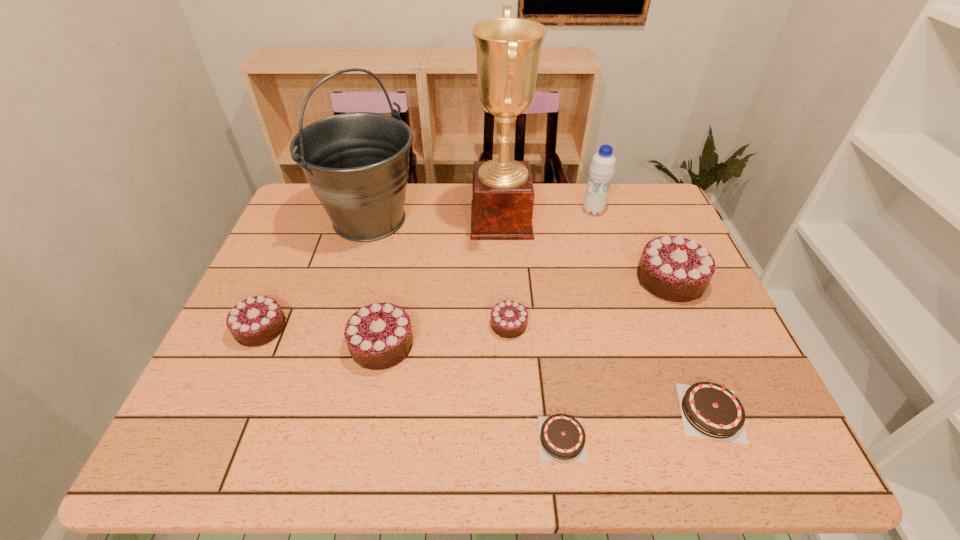
Where is `the fourth shortest object`? Image resolution: width=960 pixels, height=540 pixels. the fourth shortest object is located at coordinates (251, 417).

Locate an element on the screen. the smallest chocolate chocolate cake is located at coordinates (293, 436).

Where is `the third chocolate chocolate cake from left to right`? This screenshot has width=960, height=540. the third chocolate chocolate cake from left to right is located at coordinates (293, 436).

The height and width of the screenshot is (540, 960). I want to click on the second shortest chocolate cake, so click(x=293, y=436).

The height and width of the screenshot is (540, 960). I want to click on the right brown chocolate cake, so click(293, 436).

Identify the location of the smaller brown chocolate cake. This screenshot has height=540, width=960. (293, 436).

Find the location of a particular element. The width and height of the screenshot is (960, 540). the shortest object is located at coordinates (293, 436).

Locate an element on the screen. vacant region located 0.140m on the plaque of the tallest object is located at coordinates (426, 220).

Identify the location of free space located 0.320m on the plaque of the tallest object. (368, 220).

At what (x,y) coordinates should I click in order to perform the action: click on vacant space located 0.300m on the plaque of the tallest object. Please return your answer as a coordinate pair (x, y). Looking at the image, I should click on (374, 220).